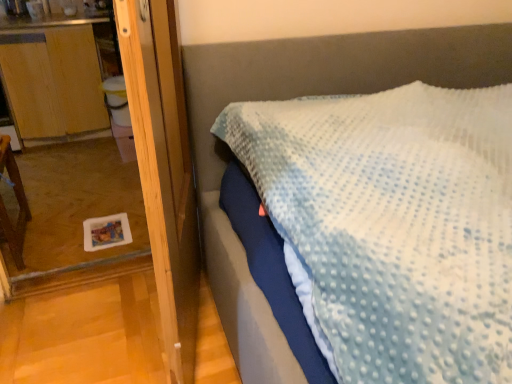
Question: Is wooden screen door at left at the back of brown wooden chair at left?

Choices:
 (A) no
 (B) yes

Answer: (A)

Question: From a real-world perspective, is brown wooden chair at left positioned over wooden screen door at left based on gravity?

Choices:
 (A) no
 (B) yes

Answer: (A)

Question: Does brown wooden chair at left have a lesser height compared to wooden screen door at left?

Choices:
 (A) no
 (B) yes

Answer: (B)

Question: Does brown wooden chair at left have a greater height compared to wooden screen door at left?

Choices:
 (A) yes
 (B) no

Answer: (B)

Question: Is brown wooden chair at left not inside wooden screen door at left?

Choices:
 (A) no
 (B) yes

Answer: (B)

Question: Is brown wooden chair at left closer to the viewer compared to wooden screen door at left?

Choices:
 (A) yes
 (B) no

Answer: (B)

Question: Is wooden dresser at left inside wooden screen door at left?

Choices:
 (A) no
 (B) yes

Answer: (A)

Question: Is wooden screen door at left completely or partially outside of wooden dresser at left?

Choices:
 (A) yes
 (B) no

Answer: (A)

Question: Is wooden screen door at left at the left side of wooden dresser at left?

Choices:
 (A) no
 (B) yes

Answer: (A)

Question: Considering the relative sizes of wooden screen door at left and wooden dresser at left in the image provided, is wooden screen door at left shorter than wooden dresser at left?

Choices:
 (A) no
 (B) yes

Answer: (A)

Question: From a real-world perspective, is wooden screen door at left on top of wooden dresser at left?

Choices:
 (A) yes
 (B) no

Answer: (A)

Question: Is wooden screen door at left taller than wooden dresser at left?

Choices:
 (A) no
 (B) yes

Answer: (B)

Question: Does wooden dresser at left appear on the left side of wooden screen door at left?

Choices:
 (A) no
 (B) yes

Answer: (B)